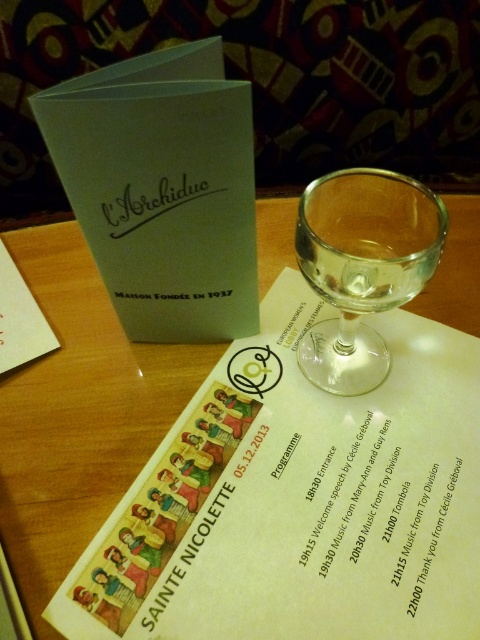
Question: Which point is farther from the camera taking this photo?

Choices:
 (A) (380, 282)
 (B) (56, 452)

Answer: (B)

Question: Based on their relative distances, which object is farther from the transparent glass wine glass at center?

Choices:
 (A) wooden table at center
 (B) clear glass wine at center

Answer: (A)

Question: Which point appears farthest from the camera in this image?

Choices:
 (A) (408, 292)
 (B) (73, 396)

Answer: (B)

Question: Is wooden table at center to the right of transparent glass wine glass at center from the viewer's perspective?

Choices:
 (A) yes
 (B) no

Answer: (B)

Question: Is wooden table at center wider than transparent glass wine glass at center?

Choices:
 (A) yes
 (B) no

Answer: (A)

Question: Does transparent glass wine glass at center appear on the left side of clear glass wine at center?

Choices:
 (A) no
 (B) yes

Answer: (B)